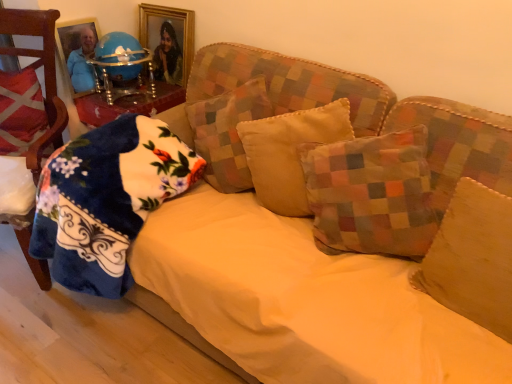
Find the location of a particular element. velvet beige pillow at center, the fourth pillow when ordered from left to right is located at coordinates (289, 152).

This screenshot has height=384, width=512. What do you see at coordinates (473, 258) in the screenshot?
I see `suede-like beige pillow at center-right, the sixth pillow in the left-to-right sequence` at bounding box center [473, 258].

This screenshot has height=384, width=512. Identify the location of velvet beige pillow at center, which ranks as the third pillow in right-to-left order. (289, 152).

Does patchwork fabric pillow at center, positioned as the 3th pillow in left-to-right order, have a smaller size compared to gold-framed picture at upper center?

Incorrect, patchwork fabric pillow at center, positioned as the 3th pillow in left-to-right order, is not smaller in size than gold-framed picture at upper center.

Is point (208, 148) positioned behind point (175, 53)?

No, (208, 148) is in front of (175, 53).

Between patchwork fabric pillow at center, positioned as the 3th pillow in left-to-right order, and gold-framed picture at upper center, which one has less height?

gold-framed picture at upper center.

What's the angular difference between yellow fabric sheet at center and suede-like beige pillow at center-right, the sixth pillow in the left-to-right sequence,'s facing directions?

They differ by 0.000463 degrees in their facing directions.

Image resolution: width=512 pixels, height=384 pixels. In order to click on sheet in front of the suede-like beige pillow at center-right, marked as the 1th pillow in a right-to-left arrangement in this screenshot , I will do `click(303, 300)`.

Is yellow fabric sheet at center located outside suede-like beige pillow at center-right, marked as the 1th pillow in a right-to-left arrangement?

Yes.

Considering the sizes of objects fluffy blue blanket at left, which is the fifth pillow in right-to-left order, and suede-like beige pillow at center-right, the sixth pillow in the left-to-right sequence, in the image provided, who is bigger, fluffy blue blanket at left, which is the fifth pillow in right-to-left order, or suede-like beige pillow at center-right, the sixth pillow in the left-to-right sequence,?

fluffy blue blanket at left, which is the fifth pillow in right-to-left order.

Who is more distant, fluffy blue blanket at left, the second pillow in the left-to-right sequence, or suede-like beige pillow at center-right, the sixth pillow in the left-to-right sequence?

Positioned behind is fluffy blue blanket at left, the second pillow in the left-to-right sequence.

Does point (72, 232) come behind point (484, 238)?

Yes.

Is fluffy blue blanket at left, the second pillow in the left-to-right sequence, turned away from suede-like beige pillow at center-right, marked as the 1th pillow in a right-to-left arrangement?

fluffy blue blanket at left, the second pillow in the left-to-right sequence, does not have its back to suede-like beige pillow at center-right, marked as the 1th pillow in a right-to-left arrangement.

In the scene shown: Measure the distance from yellow fabric sheet at center to red plaid pillow at left, which ranks as the sixth pillow in right-to-left order.

yellow fabric sheet at center and red plaid pillow at left, which ranks as the sixth pillow in right-to-left order, are 1.09 meters apart from each other.

Is yellow fabric sheet at center inside the boundaries of red plaid pillow at left, which ranks as the sixth pillow in right-to-left order, or outside?

yellow fabric sheet at center exists outside the volume of red plaid pillow at left, which ranks as the sixth pillow in right-to-left order.

From a real-world perspective, is yellow fabric sheet at center located higher than red plaid pillow at left, which ranks as the sixth pillow in right-to-left order?

No.

The image size is (512, 384). In order to click on sheet that appears in front of the red plaid pillow at left, which ranks as the sixth pillow in right-to-left order in this screenshot , I will do `click(303, 300)`.

From a real-world perspective, who is located higher, suede-like beige pillow at center-right, marked as the 1th pillow in a right-to-left arrangement, or patchwork fabric pillow at center, positioned as the 3th pillow in left-to-right order?

In real-world perspective, suede-like beige pillow at center-right, marked as the 1th pillow in a right-to-left arrangement, is above.

Is suede-like beige pillow at center-right, marked as the 1th pillow in a right-to-left arrangement, smaller than patchwork fabric pillow at center, the 4th pillow viewed from the right?

Correct, suede-like beige pillow at center-right, marked as the 1th pillow in a right-to-left arrangement, occupies less space than patchwork fabric pillow at center, the 4th pillow viewed from the right.

Based on the photo, is suede-like beige pillow at center-right, the sixth pillow in the left-to-right sequence, to the left of patchwork fabric pillow at center, positioned as the 3th pillow in left-to-right order, from the viewer's perspective?

Incorrect, suede-like beige pillow at center-right, the sixth pillow in the left-to-right sequence, is not on the left side of patchwork fabric pillow at center, positioned as the 3th pillow in left-to-right order.

From a real-world perspective, is velvet beige pillow at center, the fourth pillow when ordered from left to right, below suede-like beige pillow at center-right, the sixth pillow in the left-to-right sequence?

No, from a real-world perspective, velvet beige pillow at center, the fourth pillow when ordered from left to right, is not under suede-like beige pillow at center-right, the sixth pillow in the left-to-right sequence.

Considering the relative sizes of velvet beige pillow at center, the fourth pillow when ordered from left to right, and suede-like beige pillow at center-right, marked as the 1th pillow in a right-to-left arrangement, in the image provided, is velvet beige pillow at center, the fourth pillow when ordered from left to right, taller than suede-like beige pillow at center-right, marked as the 1th pillow in a right-to-left arrangement,?

Yes, velvet beige pillow at center, the fourth pillow when ordered from left to right, is taller than suede-like beige pillow at center-right, marked as the 1th pillow in a right-to-left arrangement.

How different are the orientations of velvet beige pillow at center, the fourth pillow when ordered from left to right, and suede-like beige pillow at center-right, the sixth pillow in the left-to-right sequence, in degrees?

The facing directions of velvet beige pillow at center, the fourth pillow when ordered from left to right, and suede-like beige pillow at center-right, the sixth pillow in the left-to-right sequence, are 29.2 degrees apart.

Is point (12, 118) farther from camera compared to point (362, 196)?

Yes, it is.

Considering the positions of objects red plaid pillow at left, the first pillow when ordered from left to right, and multicolored patchwork pillow at center, marked as the second pillow in a right-to-left arrangement, in the image provided, who is behind, red plaid pillow at left, the first pillow when ordered from left to right, or multicolored patchwork pillow at center, marked as the second pillow in a right-to-left arrangement,?

red plaid pillow at left, the first pillow when ordered from left to right, is further from the camera.

Is red plaid pillow at left, which ranks as the sixth pillow in right-to-left order, looking in the opposite direction of multicolored patchwork pillow at center, the 5th pillow when ordered from left to right?

red plaid pillow at left, which ranks as the sixth pillow in right-to-left order, is not turned away from multicolored patchwork pillow at center, the 5th pillow when ordered from left to right.

Which object is positioned more to the right, red plaid pillow at left, which ranks as the sixth pillow in right-to-left order, or multicolored patchwork pillow at center, marked as the second pillow in a right-to-left arrangement?

From the viewer's perspective, multicolored patchwork pillow at center, marked as the second pillow in a right-to-left arrangement, appears more on the right side.

I want to click on picture frame that is above the patchwork fabric pillow at center, positioned as the 3th pillow in left-to-right order (from the image's perspective), so click(168, 40).

Where is `the 3rd pillow counting from the right of the yellow fabric sheet at center`? The height and width of the screenshot is (384, 512). the 3rd pillow counting from the right of the yellow fabric sheet at center is located at coordinates (473, 258).

Consider the image. Considering their positions, is patchwork fabric pillow at center, positioned as the 3th pillow in left-to-right order, positioned closer to fluffy blue blanket at left, the second pillow in the left-to-right sequence, than suede-like beige pillow at center-right, the sixth pillow in the left-to-right sequence?

Among the two, patchwork fabric pillow at center, positioned as the 3th pillow in left-to-right order, is located nearer to fluffy blue blanket at left, the second pillow in the left-to-right sequence.

Considering their positions, is velvet beige pillow at center, which ranks as the third pillow in right-to-left order, positioned further to gold-framed picture at upper center than multicolored patchwork pillow at center, marked as the second pillow in a right-to-left arrangement?

multicolored patchwork pillow at center, marked as the second pillow in a right-to-left arrangement, is positioned further to the anchor gold-framed picture at upper center.

From the image, which object appears to be nearer to velvet red chair at left, patchwork fabric pillow at center, the 4th pillow viewed from the right, or velvet beige pillow at center, which ranks as the third pillow in right-to-left order?

Based on the image, patchwork fabric pillow at center, the 4th pillow viewed from the right, appears to be nearer to velvet red chair at left.

When comparing their distances from patchwork fabric pillow at center, the 4th pillow viewed from the right, does suede-like beige pillow at center-right, marked as the 1th pillow in a right-to-left arrangement, or velvet red chair at left seem further?

Among the two, suede-like beige pillow at center-right, marked as the 1th pillow in a right-to-left arrangement, is located further to patchwork fabric pillow at center, the 4th pillow viewed from the right.

Estimate the real-world distances between objects in this image. Which object is further from yellow fabric sheet at center, patchwork fabric pillow at center, the 4th pillow viewed from the right, or gold-framed picture at upper center?

gold-framed picture at upper center is positioned further to the anchor yellow fabric sheet at center.

When comparing their distances from fluffy blue blanket at left, which is the fifth pillow in right-to-left order, does red plaid pillow at left, the first pillow when ordered from left to right, or patchwork fabric pillow at center, the 4th pillow viewed from the right, seem further?

red plaid pillow at left, the first pillow when ordered from left to right, is positioned further to the anchor fluffy blue blanket at left, which is the fifth pillow in right-to-left order.

Looking at the image, which one is located further to yellow fabric sheet at center, fluffy blue blanket at left, the second pillow in the left-to-right sequence, or multicolored patchwork pillow at center, the 5th pillow when ordered from left to right?

fluffy blue blanket at left, the second pillow in the left-to-right sequence, lies further to yellow fabric sheet at center than the other object.

When comparing their distances from velvet red chair at left, does patchwork fabric pillow at center, the 4th pillow viewed from the right, or red plaid pillow at left, which ranks as the sixth pillow in right-to-left order, seem closer?

The object closer to velvet red chair at left is red plaid pillow at left, which ranks as the sixth pillow in right-to-left order.

Image resolution: width=512 pixels, height=384 pixels. I want to click on pillow between velvet beige pillow at center, which ranks as the third pillow in right-to-left order, and suede-like beige pillow at center-right, marked as the 1th pillow in a right-to-left arrangement, from left to right, so click(x=371, y=194).

At what (x,y) coordinates should I click in order to perform the action: click on pillow between fluffy blue blanket at left, which is the fifth pillow in right-to-left order, and velvet beige pillow at center, the fourth pillow when ordered from left to right, in the horizontal direction. Please return your answer as a coordinate pair (x, y). This screenshot has height=384, width=512. Looking at the image, I should click on (227, 133).

Where is `picture frame between velvet red chair at left and patchwork fabric pillow at center, the 4th pillow viewed from the right, from left to right`? The image size is (512, 384). picture frame between velvet red chair at left and patchwork fabric pillow at center, the 4th pillow viewed from the right, from left to right is located at coordinates (168, 40).

Find the location of a particular element. The image size is (512, 384). picture frame between fluffy blue blanket at left, the second pillow in the left-to-right sequence, and multicolored patchwork pillow at center, marked as the second pillow in a right-to-left arrangement, in the horizontal direction is located at coordinates (168, 40).